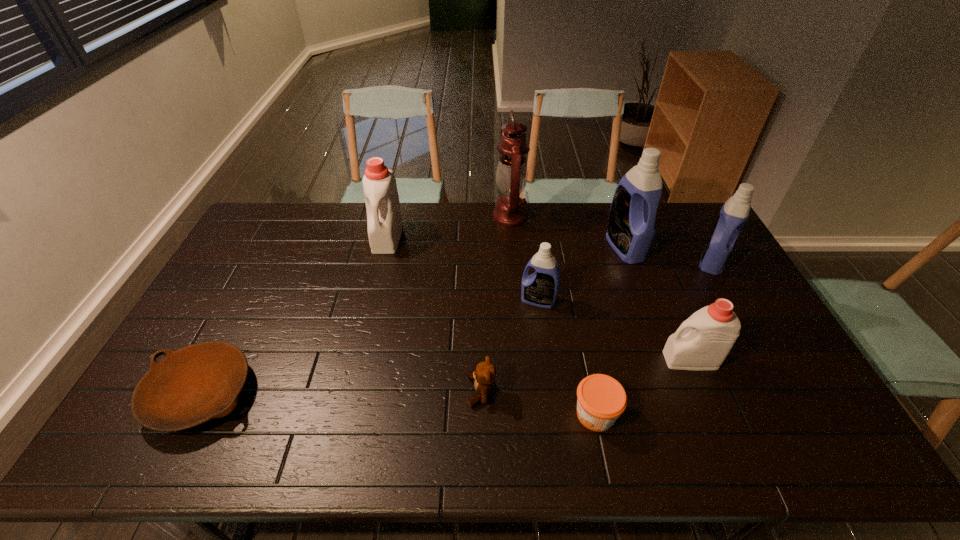
In order to click on object that is the second closest to the jam in this screenshot , I will do `click(485, 375)`.

Where is `the third closest detergent to the right white detergent`? This screenshot has width=960, height=540. the third closest detergent to the right white detergent is located at coordinates (630, 232).

Identify the location of detergent that is the nearest to the tallest detergent. (734, 213).

Image resolution: width=960 pixels, height=540 pixels. What are the coordinates of `blue detergent that stands as the closest to the smallest blue detergent` in the screenshot? It's located at (630, 232).

This screenshot has height=540, width=960. I want to click on blue detergent that is the second closest to the farther white detergent, so click(630, 232).